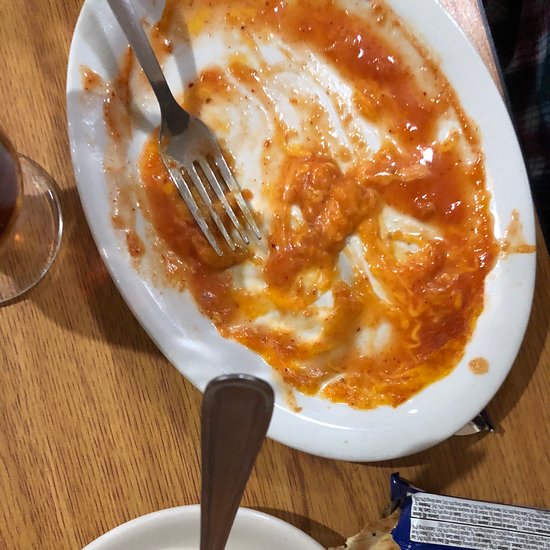
I want to click on piece of silverware, so click(x=142, y=41), click(x=225, y=443).